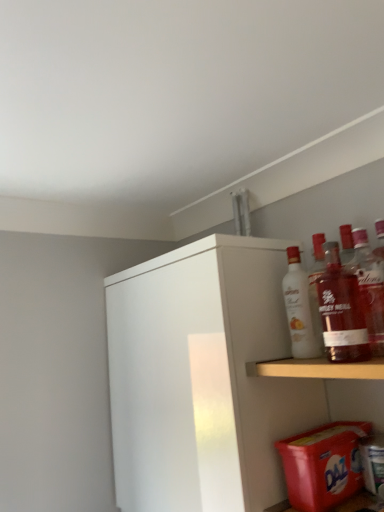
Question: Can you confirm if white glossy bottle at upper right, positioned as the 1th bottle in left-to-right order, is thinner than white matte cabinet at upper right?

Choices:
 (A) yes
 (B) no

Answer: (A)

Question: Is white glossy bottle at upper right, which appears as the 1th bottle when viewed from the back, next to white matte cabinet at upper right?

Choices:
 (A) yes
 (B) no

Answer: (B)

Question: Does white glossy bottle at upper right, placed as the 2th bottle when sorted from right to left, have a smaller size compared to white matte cabinet at upper right?

Choices:
 (A) yes
 (B) no

Answer: (A)

Question: From a real-world perspective, is white glossy bottle at upper right, which appears as the 1th bottle when viewed from the back, positioned over white matte cabinet at upper right based on gravity?

Choices:
 (A) yes
 (B) no

Answer: (A)

Question: Is white glossy bottle at upper right, positioned as the 1th bottle in left-to-right order, oriented towards white matte cabinet at upper right?

Choices:
 (A) yes
 (B) no

Answer: (B)

Question: Does point (362, 270) appear closer or farther from the camera than point (311, 350)?

Choices:
 (A) farther
 (B) closer

Answer: (B)

Question: Which is correct: translucent glass bottle at upper right, the 1th bottle in the right-to-left sequence, is inside white glossy bottle at upper right, which is the 2th bottle from front to back, or outside of it?

Choices:
 (A) outside
 (B) inside

Answer: (A)

Question: Looking at their shapes, would you say translucent glass bottle at upper right, marked as the first bottle in a front-to-back arrangement, is wider or thinner than white glossy bottle at upper right, which appears as the 1th bottle when viewed from the back?

Choices:
 (A) wide
 (B) thin

Answer: (A)

Question: Relative to white glossy bottle at upper right, positioned as the 1th bottle in left-to-right order, is translucent glass bottle at upper right, marked as the first bottle in a front-to-back arrangement, in front or behind?

Choices:
 (A) front
 (B) behind

Answer: (A)

Question: Does point (243, 365) appear closer or farther from the camera than point (379, 337)?

Choices:
 (A) farther
 (B) closer

Answer: (A)

Question: In the image, is white matte cabinet at upper right positioned in front of or behind translucent glass bottle at shelf right?

Choices:
 (A) behind
 (B) front

Answer: (A)

Question: Choose the correct answer: Is white matte cabinet at upper right inside translucent glass bottle at shelf right or outside it?

Choices:
 (A) outside
 (B) inside

Answer: (A)

Question: In terms of size, does white matte cabinet at upper right appear bigger or smaller than translucent glass bottle at shelf right?

Choices:
 (A) big
 (B) small

Answer: (A)

Question: Looking at their shapes, would you say translucent glass bottle at upper right, the second bottle viewed from the left, is wider or thinner than red plastic laundry detergent at lower right?

Choices:
 (A) thin
 (B) wide

Answer: (A)

Question: In the image, is translucent glass bottle at upper right, which is the second bottle from back to front, positioned in front of or behind red plastic laundry detergent at lower right?

Choices:
 (A) behind
 (B) front

Answer: (B)